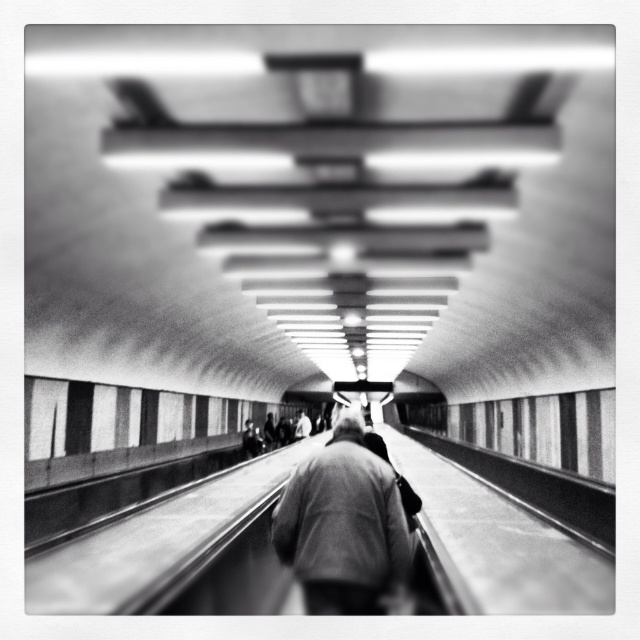
Can you confirm if dark gray wool coat at center is thinner than light gray fabric jacket at center?

No, dark gray wool coat at center is not thinner than light gray fabric jacket at center.

Describe the element at coordinates (342, 525) in the screenshot. I see `dark gray wool coat at center` at that location.

Is point (397, 557) closer to viewer compared to point (298, 413)?

Yes.

This screenshot has height=640, width=640. I want to click on dark gray wool coat at center, so click(342, 525).